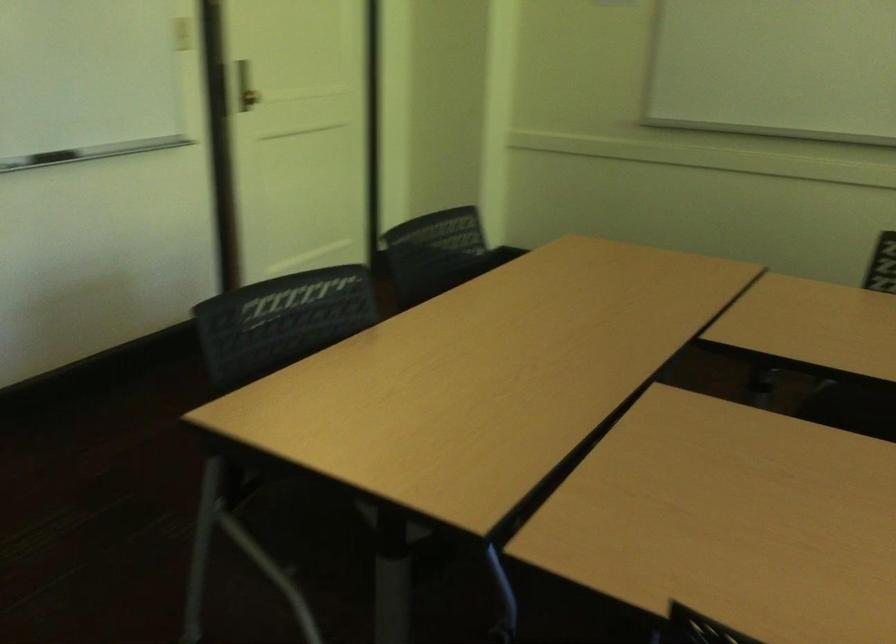
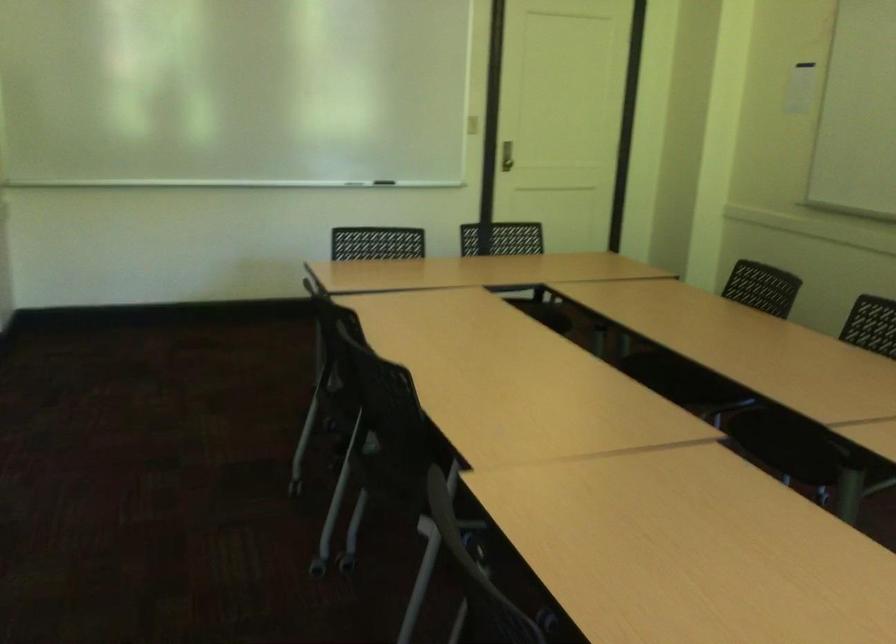
In the second image, find the point that corresponds to (x=243, y=100) in the first image.

(506, 156)